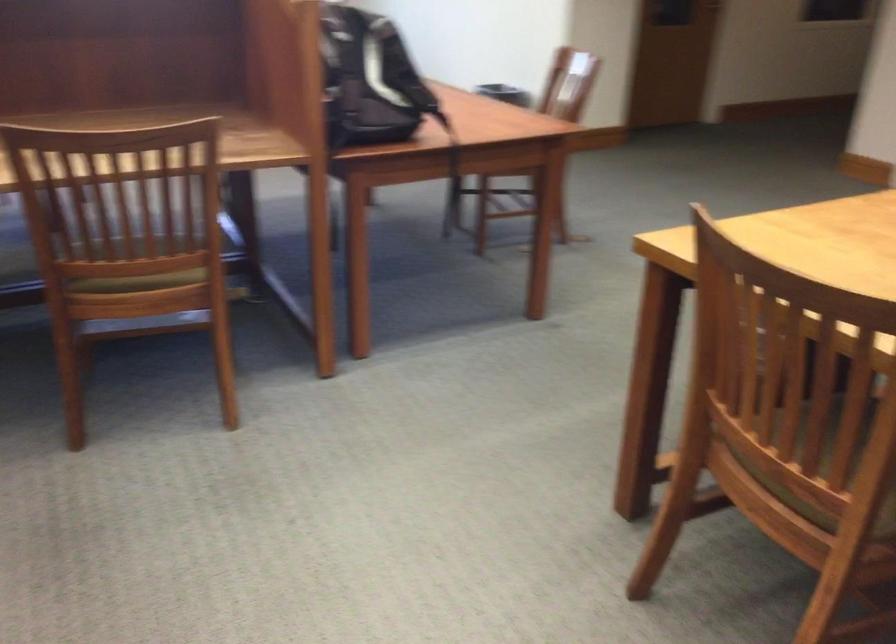
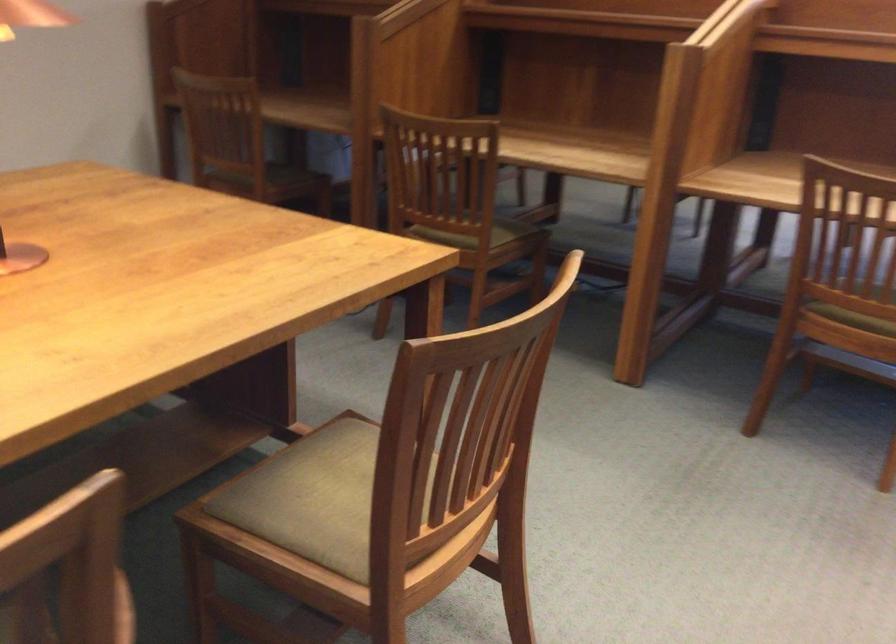
Locate, in the second image, the point that corresponds to (125,283) in the first image.

(855, 313)